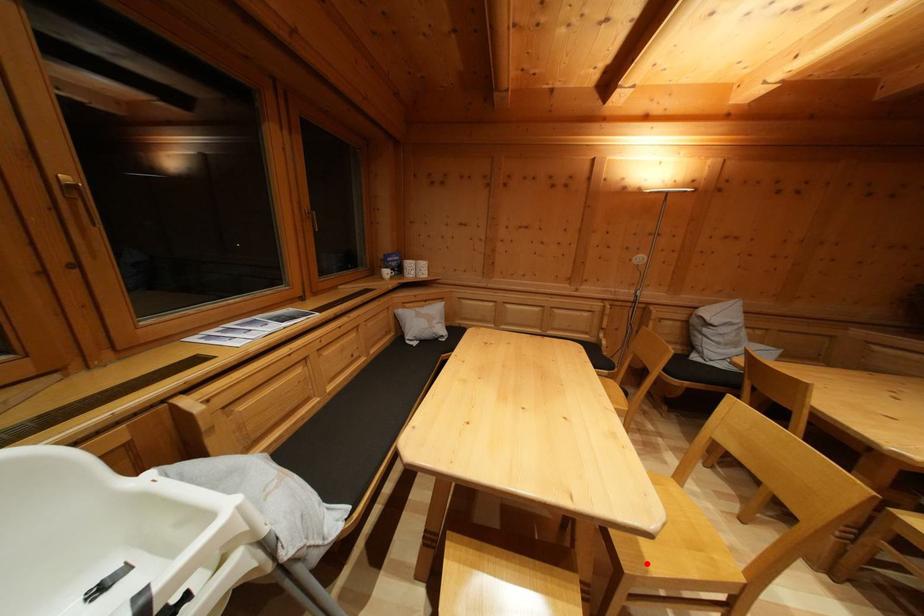
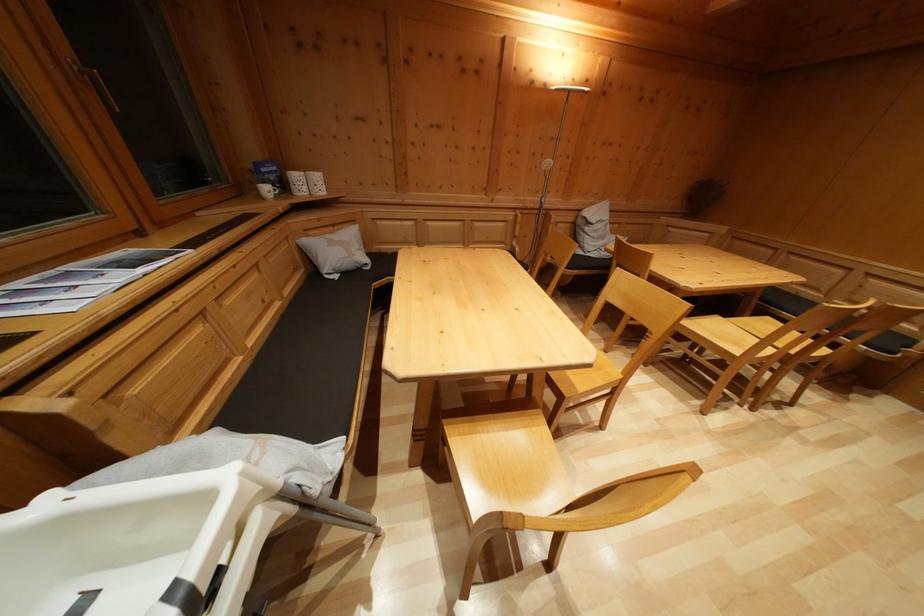
Question: I am providing you with two images of the same scene from different viewpoints. A red point is shown in image1. For the corresponding object point in image2, is it positioned nearer or farther from the camera?

Choices:
 (A) Nearer
 (B) Farther

Answer: (B)